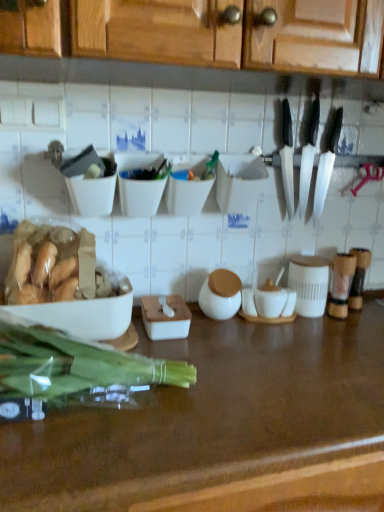
Identify the location of free location to the right of translucent plastic green vegetables at left. (232, 392).